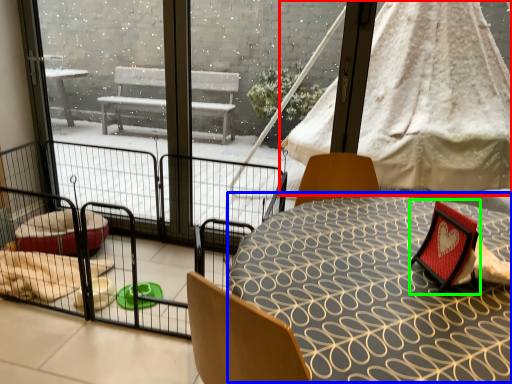
Question: Which object is positioned farthest from canopy bed (highlighted by a red box)? Select from round table (highlighted by a blue box) and armchair (highlighted by a green box).

Choices:
 (A) round table
 (B) armchair

Answer: (B)